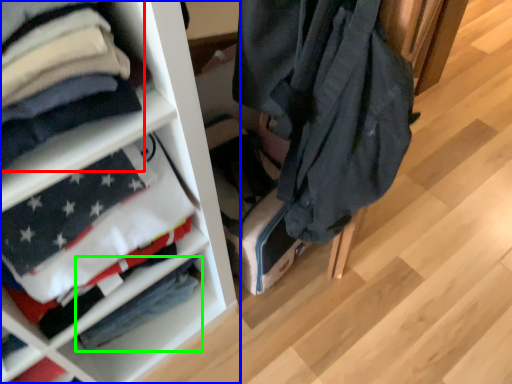
Question: Based on their relative distances, which object is farther from cloak (highlighted by a red box)? Choose from shelf (highlighted by a blue box) and flag (highlighted by a green box).

Choices:
 (A) shelf
 (B) flag

Answer: (B)